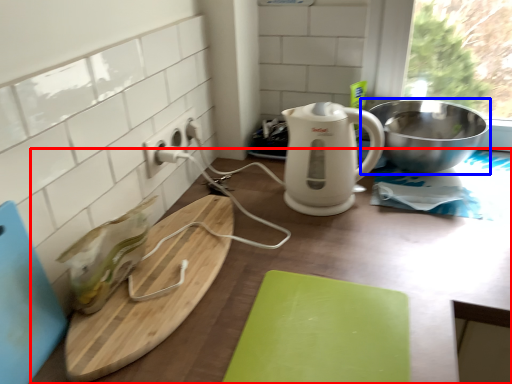
Question: Which object appears closest to the camera in this image, counter (highlighted by a red box) or bowl (highlighted by a blue box)?

Choices:
 (A) counter
 (B) bowl

Answer: (A)